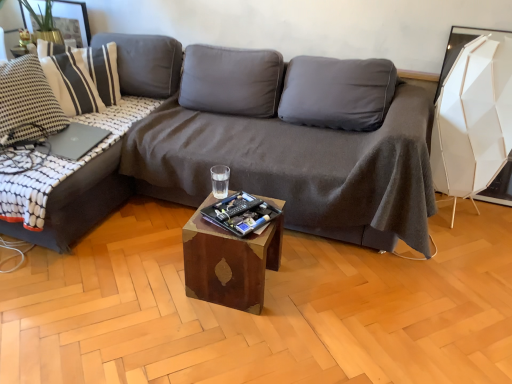
This screenshot has height=384, width=512. I want to click on vacant space that's between wooden cube at center and dark gray fabric couch at center, placed as the second studio couch when sorted from left to right, so click(278, 278).